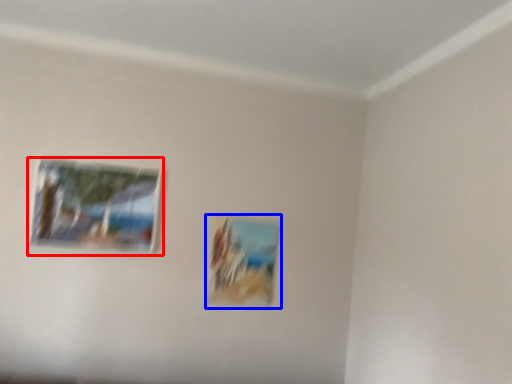
Question: Which object appears farthest to the camera in this image, picture frame (highlighted by a red box) or picture frame (highlighted by a blue box)?

Choices:
 (A) picture frame
 (B) picture frame

Answer: (B)